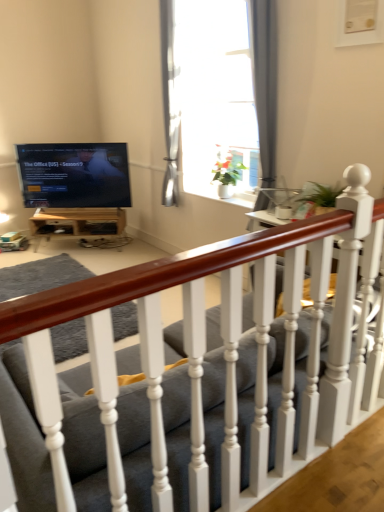
Question: Considering the positions of wooden table at lower left and matte black tv at upper left in the image, is wooden table at lower left bigger or smaller than matte black tv at upper left?

Choices:
 (A) small
 (B) big

Answer: (A)

Question: Do you think wooden table at lower left is within matte black tv at upper left, or outside of it?

Choices:
 (A) outside
 (B) inside

Answer: (A)

Question: Based on their relative distances, which object is farther from the white glossy window at upper center?

Choices:
 (A) matte gray fabric couch at center
 (B) matte black tv at upper left
 (C) wooden table at lower left

Answer: (A)

Question: Which object is the closest to the white glossy window at upper center?

Choices:
 (A) matte black tv at upper left
 (B) matte gray fabric couch at center
 (C) wooden table at lower left

Answer: (A)